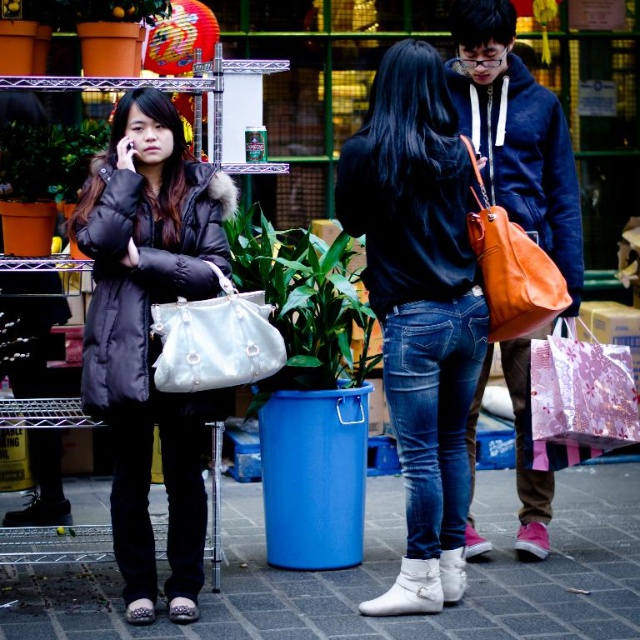
You are a street artist planning to paint a mural on the wall behind the green leafy plant at left and the white leather handbag at center. Which object should you move first to have a clear view of the wall?

You should move the green leafy plant at left first because it is positioned to the left of the white leather handbag at center, meaning it is closer to the wall and obstructing the view more directly.